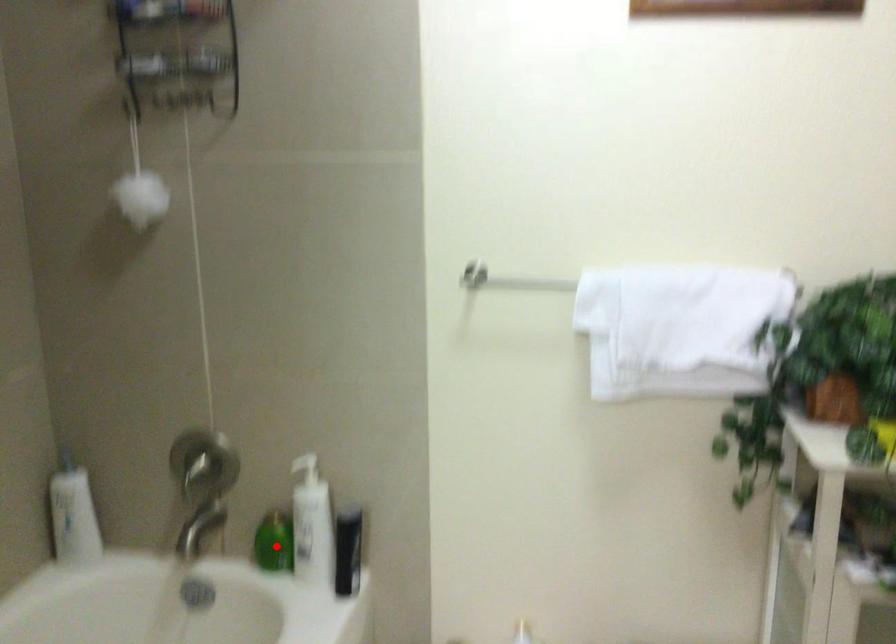
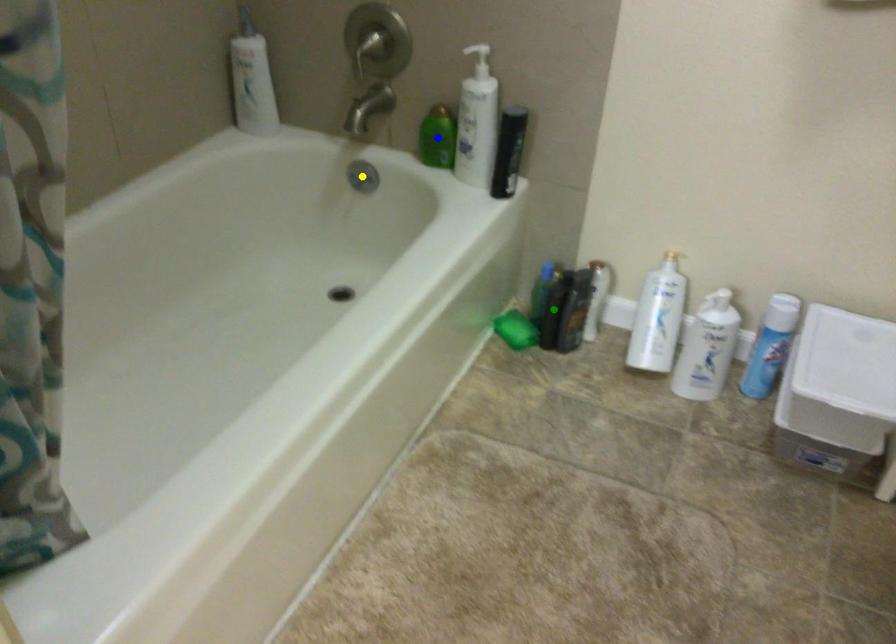
Question: I am providing you with two images of the same scene from different viewpoints. A red point is marked on the first image. You are given multiple points on the second image. Can you choose the point in image 2 that corresponds to the point in image 1?

Choices:
 (A) yellow point
 (B) blue point
 (C) green point

Answer: (B)